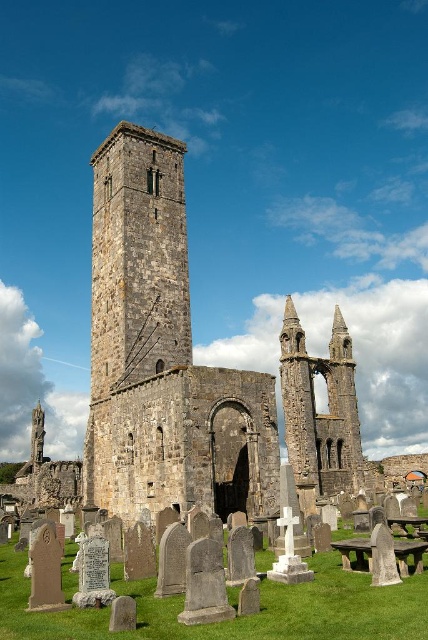
Question: Which object appears closest to the camera in this image?

Choices:
 (A) stone tower at center
 (B) wooden picnic table at center
 (C) stone steeple at center

Answer: (B)

Question: Is stone tower at center above stone steeple at center?

Choices:
 (A) no
 (B) yes

Answer: (B)

Question: Estimate the real-world distances between objects in this image. Which object is farther from the stone tower at center?

Choices:
 (A) wooden picnic table at center
 (B) rustic stone tower at center

Answer: (A)

Question: Which point is closer to the camera?

Choices:
 (A) wooden picnic table at center
 (B) stone tower at center

Answer: (A)

Question: Is stone tower at center bigger than wooden picnic table at center?

Choices:
 (A) no
 (B) yes

Answer: (B)

Question: From the image, what is the correct spatial relationship of stone steeple at center in relation to wooden picnic table at center?

Choices:
 (A) right
 (B) left

Answer: (B)